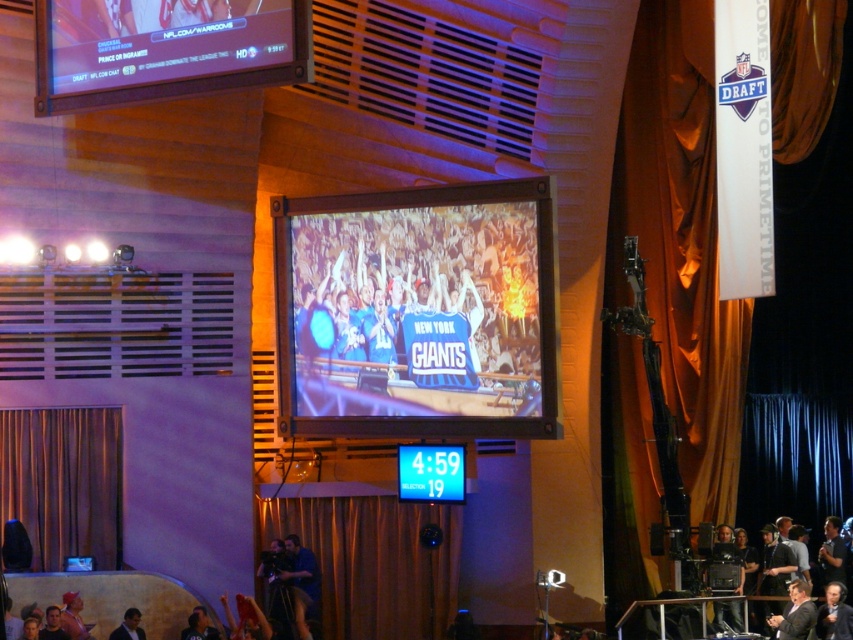
Question: Is matte black tv at center to the right of dark gray suit at lower right from the viewer's perspective?

Choices:
 (A) yes
 (B) no

Answer: (B)

Question: Which point appears closest to the camera in this image?

Choices:
 (A) (120, 637)
 (B) (781, 637)

Answer: (A)

Question: Considering the relative positions of matte black tv at center and matte black screen at upper left in the image provided, where is matte black tv at center located with respect to matte black screen at upper left?

Choices:
 (A) left
 (B) right

Answer: (B)

Question: Is matte black screen at upper left thinner than dark gray suit at lower center?

Choices:
 (A) no
 (B) yes

Answer: (B)

Question: Which is nearer to the matte black tv at center?

Choices:
 (A) dark gray suit at lower center
 (B) dark gray suit at lower right
 (C) matte black screen at upper left

Answer: (A)

Question: Which point is closer to the camera?

Choices:
 (A) matte black screen at upper left
 (B) dark gray suit at lower right
 (C) dark gray suit at lower center
 (D) matte black tv at center

Answer: (A)